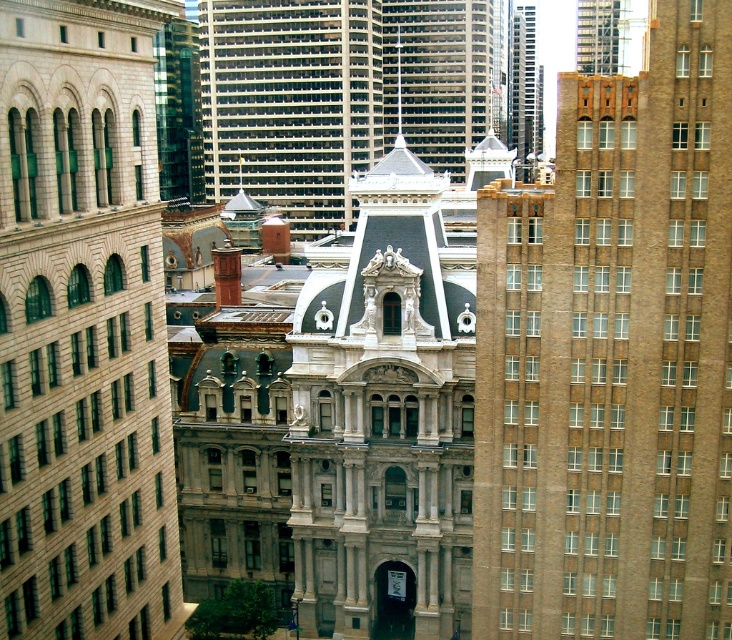
Which of these two, brown brick building at center or gray concrete skyscraper at center, stands shorter?

With less height is brown brick building at center.

Can you confirm if brown brick building at center is positioned to the right of gray concrete skyscraper at center?

Correct, you'll find brown brick building at center to the right of gray concrete skyscraper at center.

Does point (539, 237) come in front of point (209, 156)?

Yes, it is.

Find the location of `brown brick building at center`. brown brick building at center is located at coordinates (612, 356).

Locate an element on the screen. The image size is (732, 640). brown brick building at center is located at coordinates (612, 356).

Where is `brown brick building at center`? Image resolution: width=732 pixels, height=640 pixels. brown brick building at center is located at coordinates (612, 356).

From the picture: Who is lower down, brown brick building at center or beige stone building at left?

beige stone building at left is lower down.

Between point (616, 520) and point (67, 548), which one is positioned behind?

The point (616, 520) is more distant.

What do you see at coordinates (612, 356) in the screenshot? I see `brown brick building at center` at bounding box center [612, 356].

This screenshot has width=732, height=640. What are the coordinates of `brown brick building at center` in the screenshot? It's located at 612,356.